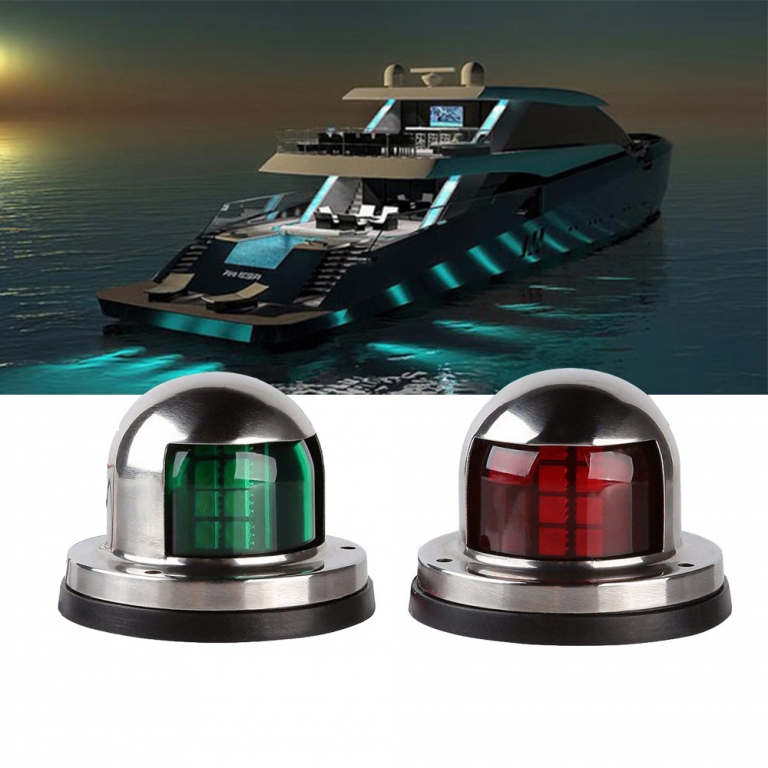
Identify the location of stairs. (343, 255).